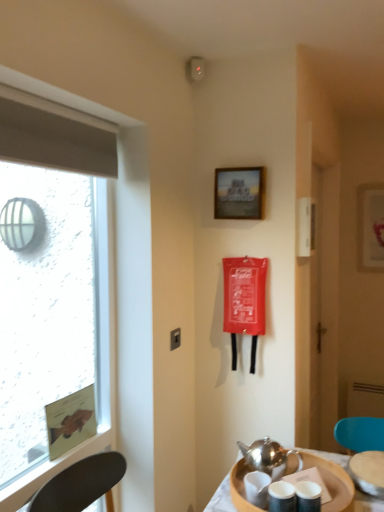
Question: Does metallic silver teapot at lower right have a greater width compared to transparent glass window at left?

Choices:
 (A) no
 (B) yes

Answer: (B)

Question: Is metallic silver teapot at lower right oriented away from transparent glass window at left?

Choices:
 (A) no
 (B) yes

Answer: (A)

Question: Is metallic silver teapot at lower right to the right of transparent glass window at left from the viewer's perspective?

Choices:
 (A) no
 (B) yes

Answer: (B)

Question: Is metallic silver teapot at lower right positioned in front of transparent glass window at left?

Choices:
 (A) yes
 (B) no

Answer: (B)

Question: Is the surface of metallic silver teapot at lower right in direct contact with transparent glass window at left?

Choices:
 (A) yes
 (B) no

Answer: (B)

Question: From a real-world perspective, is wooden tray at lower right above or below polished silver teapot at lower center?

Choices:
 (A) above
 (B) below

Answer: (B)

Question: Do you think wooden tray at lower right is within polished silver teapot at lower center, or outside of it?

Choices:
 (A) outside
 (B) inside

Answer: (A)

Question: Considering the positions of wooden tray at lower right and polished silver teapot at lower center in the image, is wooden tray at lower right taller or shorter than polished silver teapot at lower center?

Choices:
 (A) short
 (B) tall

Answer: (A)

Question: From the image's perspective, relative to polished silver teapot at lower center, is wooden tray at lower right above or below?

Choices:
 (A) above
 (B) below

Answer: (B)

Question: From the image's perspective, is white glossy picture frame at upper right, placed as the second picture frame when sorted from left to right, positioned above or below transparent glass window at left?

Choices:
 (A) above
 (B) below

Answer: (A)

Question: Is white glossy picture frame at upper right, placed as the second picture frame when sorted from left to right, inside or outside of transparent glass window at left?

Choices:
 (A) outside
 (B) inside

Answer: (A)

Question: From a real-world perspective, relative to transparent glass window at left, is white glossy picture frame at upper right, which is the first picture frame from right to left, vertically above or below?

Choices:
 (A) above
 (B) below

Answer: (A)

Question: Does point (367, 198) appear closer or farther from the camera than point (79, 457)?

Choices:
 (A) farther
 (B) closer

Answer: (A)

Question: From the image's perspective, relative to metallic silver teapot at lower right, is transparent glass window at left above or below?

Choices:
 (A) above
 (B) below

Answer: (A)

Question: In the image, is transparent glass window at left on the left side or the right side of metallic silver teapot at lower right?

Choices:
 (A) right
 (B) left

Answer: (B)